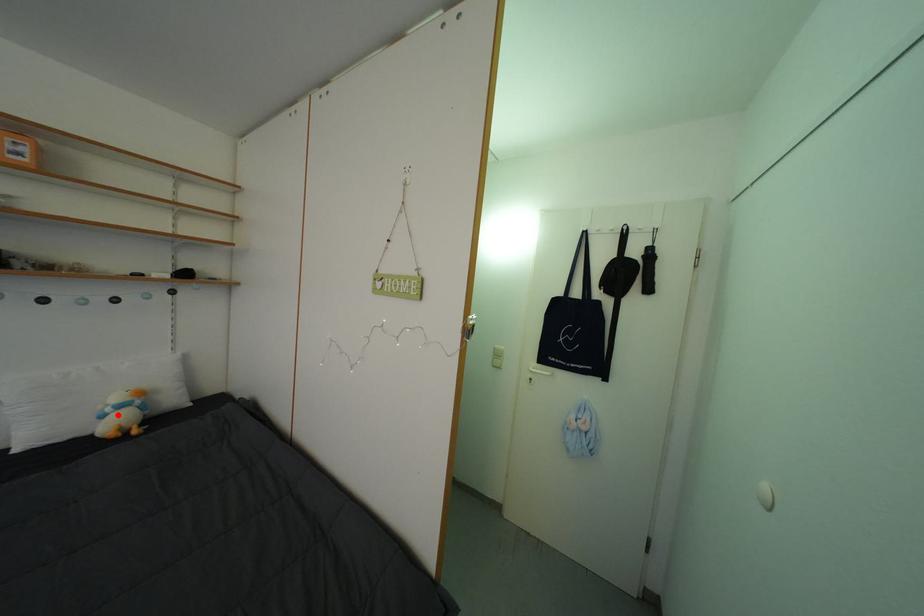
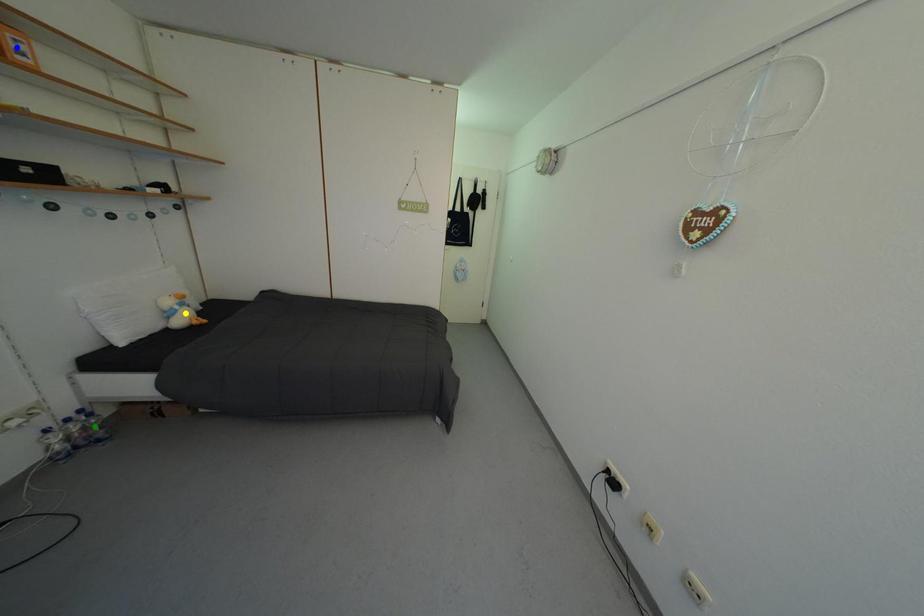
Question: I am providing you with two images of the same scene from different viewpoints. A red point is marked on the first image. You are given multiple points on the second image. Which mark in image 2 goes with the point in image 1?

Choices:
 (A) green point
 (B) blue point
 (C) yellow point

Answer: (C)